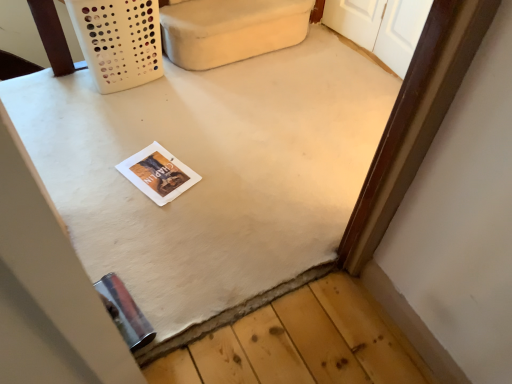
Measure the distance between point (183, 182) and camera.

The distance of point (183, 182) from camera is 5.48 feet.

The height and width of the screenshot is (384, 512). I want to click on white fabric couch at upper center, so click(230, 30).

Looking at the image, does white matte table at center seem bigger or smaller compared to white fabric couch at upper center?

Considering their sizes, white matte table at center takes up more space than white fabric couch at upper center.

Which object is further away from the camera taking this photo, white matte table at center or white fabric couch at upper center?

white fabric couch at upper center is more distant.

Is white matte table at center facing away from white fabric couch at upper center?

That's not correct — white matte table at center is not looking away from white fabric couch at upper center.

Are white matte table at center and white fabric couch at upper center located far from each other?

No, white matte table at center is not far away from white fabric couch at upper center.

Is white paper magazine at center not inside white matte table at center?

No, white paper magazine at center is not entirely external to white matte table at center.

Relative to white matte table at center, is white paper magazine at center in front or behind?

Clearly, white paper magazine at center is behind white matte table at center.

Is white matte table at center at the back of white paper magazine at center?

Yes, white matte table at center is at the back of white paper magazine at center.

Based on the photo, which of these two, white paper magazine at center or white matte table at center, stands taller?

white matte table at center.

Are white matte table at center and white paper magazine at center making contact?

There is a gap between white matte table at center and white paper magazine at center.

From a real-world perspective, which object stands above the other?

white matte table at center is physically above.

Which is in front, white matte table at center or white paper magazine at center?

white matte table at center is more forward.

Is white fabric couch at upper center with white paper magazine at center?

No, white fabric couch at upper center is not with white paper magazine at center.

Measure the distance from white fabric couch at upper center to white paper magazine at center.

white fabric couch at upper center is 29.40 inches from white paper magazine at center.

From the image's perspective, is white fabric couch at upper center under white paper magazine at center?

Actually, white fabric couch at upper center appears above white paper magazine at center in the image.

Is point (172, 172) behind point (261, 52)?

No, (172, 172) is closer to viewer.

How different are the orientations of white paper magazine at center and white fabric couch at upper center in degrees?

The angle between the facing direction of white paper magazine at center and the facing direction of white fabric couch at upper center is 163 degrees.

Between white paper magazine at center and white fabric couch at upper center, which one appears on the left side from the viewer's perspective?

white paper magazine at center.

Is white paper magazine at center turned away from white fabric couch at upper center?

That's not correct — white paper magazine at center is not looking away from white fabric couch at upper center.

Is the depth of white fabric couch at upper center less than that of white matte table at center?

No.

From a real-world perspective, is white fabric couch at upper center beneath white matte table at center?

Actually, white fabric couch at upper center is physically above white matte table at center in the real world.

From the image's perspective, is white fabric couch at upper center beneath white matte table at center?

No, from the image's perspective, white fabric couch at upper center is not below white matte table at center.

Consider the image. Is white fabric couch at upper center with white matte table at center?

No, white fabric couch at upper center is not touching white matte table at center.

The height and width of the screenshot is (384, 512). In order to click on table that appears below the white fabric couch at upper center (from the image's perspective) in this screenshot , I will do `click(212, 173)`.

The image size is (512, 384). What are the coordinates of `table in front of the white paper magazine at center` in the screenshot? It's located at (212, 173).

Based on their spatial positions, is white paper magazine at center or white fabric couch at upper center further from white matte table at center?

white fabric couch at upper center.

When comparing their distances from white fabric couch at upper center, does white matte table at center or white paper magazine at center seem closer?

white matte table at center is positioned closer to the anchor white fabric couch at upper center.

Based on their spatial positions, is white matte table at center or white fabric couch at upper center further from white paper magazine at center?

Among the two, white fabric couch at upper center is located further to white paper magazine at center.

When comparing their distances from white fabric couch at upper center, does white paper magazine at center or white matte table at center seem further?

white paper magazine at center lies further to white fabric couch at upper center than the other object.

Which object lies further to the anchor point white paper magazine at center, white fabric couch at upper center or white matte table at center?

white fabric couch at upper center is further to white paper magazine at center.

Looking at the image, which one is located closer to white matte table at center, white fabric couch at upper center or white paper magazine at center?

white paper magazine at center.

Identify the location of table between white fabric couch at upper center and white paper magazine at center from top to bottom. (212, 173).